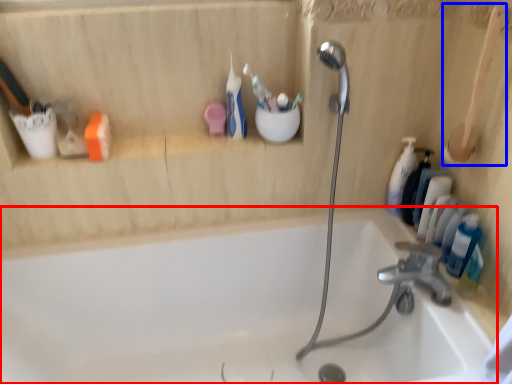
Question: Which object is closer to the camera taking this photo, bathtub (highlighted by a red box) or brush (highlighted by a blue box)?

Choices:
 (A) bathtub
 (B) brush

Answer: (A)